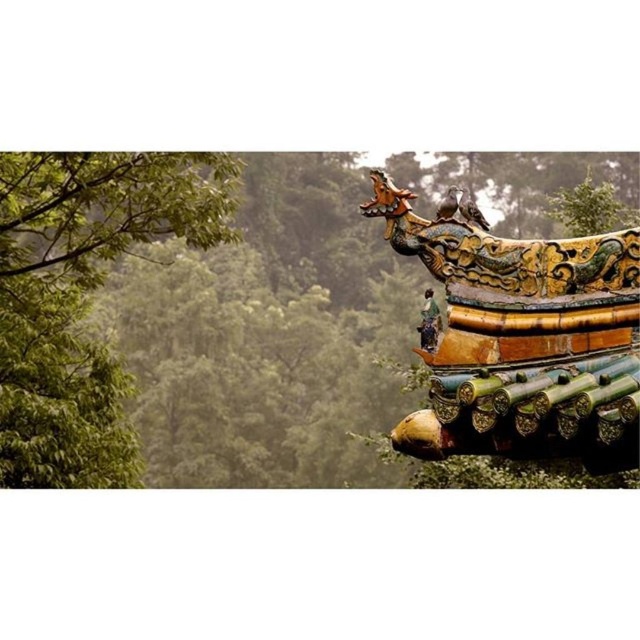
Does green leafy tree at upper left lie behind gold/gilded wood dragon at upper right?

Yes, green leafy tree at upper left is further from the viewer.

Who is lower down, green leafy tree at upper left or gold/gilded wood dragon at upper right?

gold/gilded wood dragon at upper right is lower down.

In order to click on green leafy tree at upper left in this screenshot , I will do `click(177, 352)`.

What do you see at coordinates (177, 352) in the screenshot? I see `green leafy tree at upper left` at bounding box center [177, 352].

Is the position of green leafy tree at upper left less distant than that of green leafy tree at left?

Yes, it is in front of green leafy tree at left.

Where is `green leafy tree at upper left`? The height and width of the screenshot is (640, 640). green leafy tree at upper left is located at coordinates (177, 352).

Is point (502, 284) closer to viewer compared to point (193, 180)?

Yes, point (502, 284) is in front of point (193, 180).

Can you confirm if gold/gilded wood dragon at upper right is thinner than green leafy tree at left?

Yes.

Who is more distant from viewer, (493, 273) or (141, 177)?

The point (141, 177) is behind.

The image size is (640, 640). I want to click on gold/gilded wood dragon at upper right, so click(522, 339).